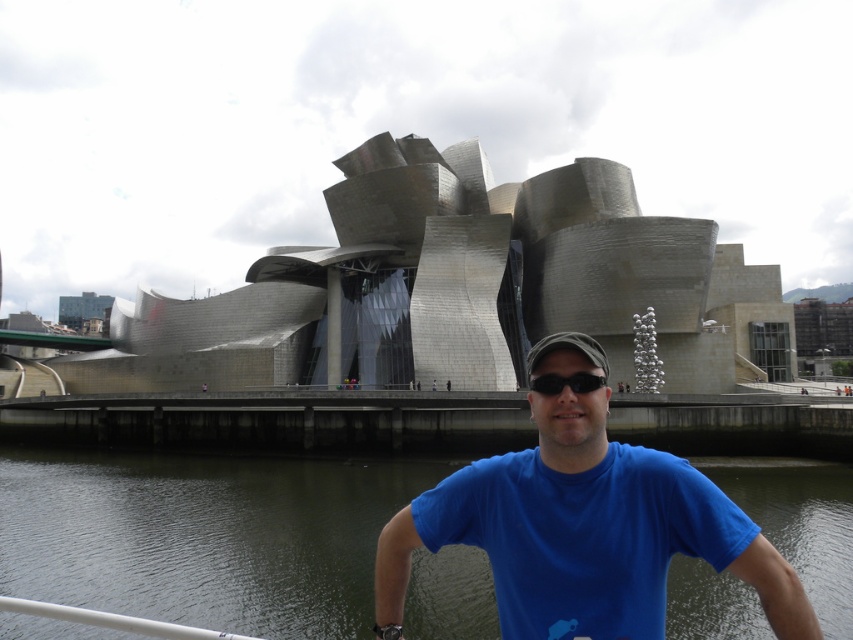
Question: Can you confirm if greenish water at lower center is positioned to the left of blue cotton shirt at center?

Choices:
 (A) yes
 (B) no

Answer: (A)

Question: Which point is closer to the camera taking this photo?

Choices:
 (A) (213, 506)
 (B) (550, 387)
 (C) (384, 545)

Answer: (C)

Question: Which object appears closest to the camera in this image?

Choices:
 (A) black matte sunglasses at center
 (B) greenish water at lower center
 (C) blue cotton shirt at center

Answer: (C)

Question: Where is greenish water at lower center located in relation to black matte sunglasses at center in the image?

Choices:
 (A) left
 (B) right

Answer: (A)

Question: Which point is closer to the camera?

Choices:
 (A) greenish water at lower center
 (B) blue cotton shirt at center
 (C) black matte sunglasses at center

Answer: (B)

Question: Can you confirm if greenish water at lower center is thinner than blue cotton shirt at center?

Choices:
 (A) yes
 (B) no

Answer: (B)